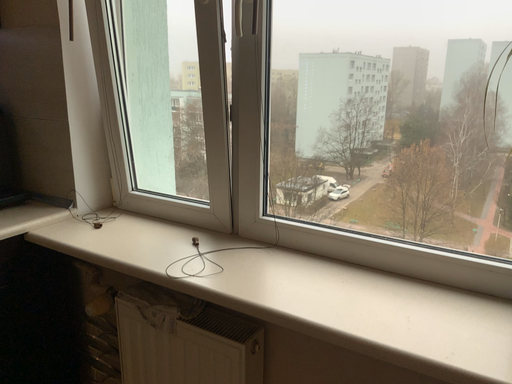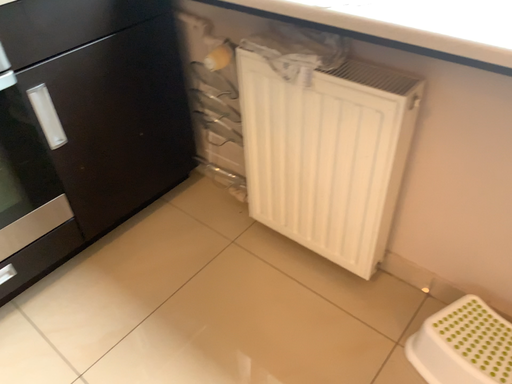
Question: How did the camera likely rotate when shooting the video?

Choices:
 (A) rotated right
 (B) rotated left

Answer: (B)